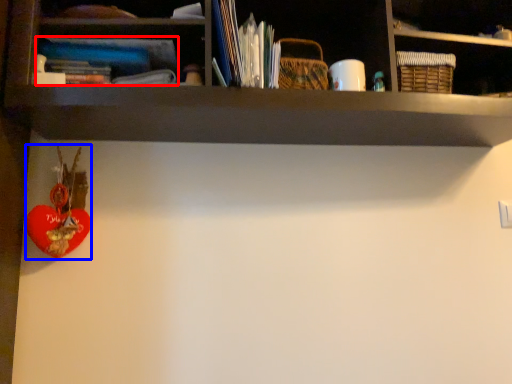
Question: Which object is further to the camera taking this photo, book (highlighted by a red box) or toy (highlighted by a blue box)?

Choices:
 (A) book
 (B) toy

Answer: (B)